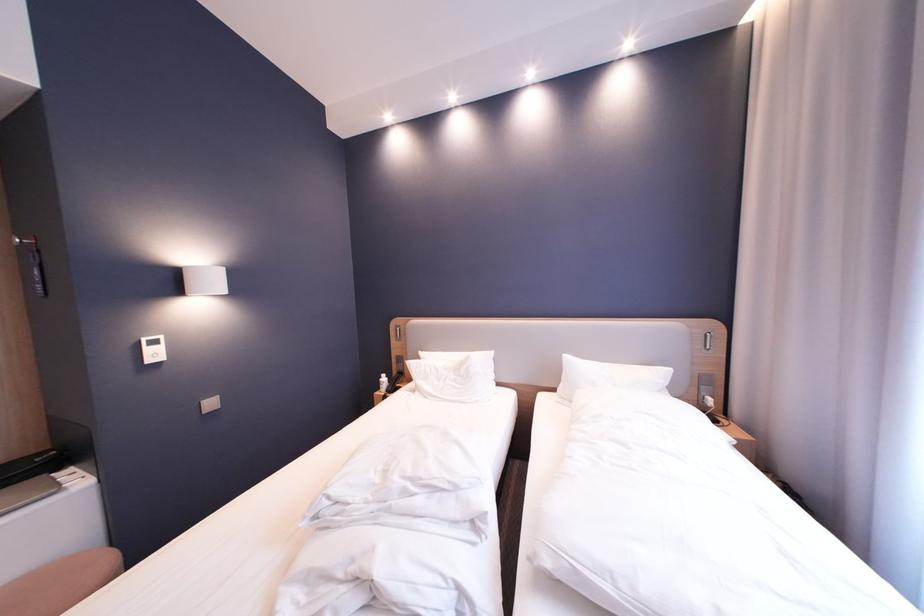
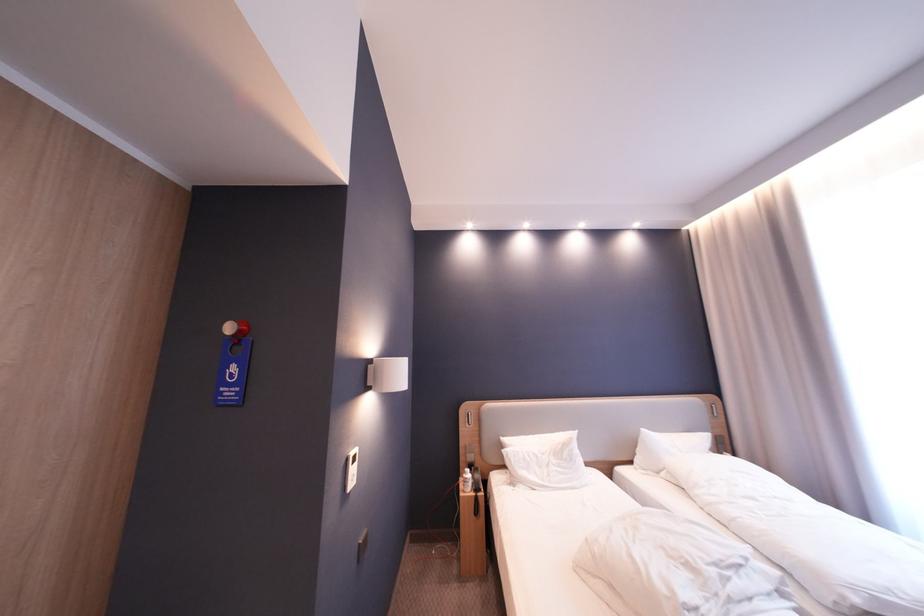
In the second image, find the point that corresponds to the point at 565,391 in the first image.

(641, 464)